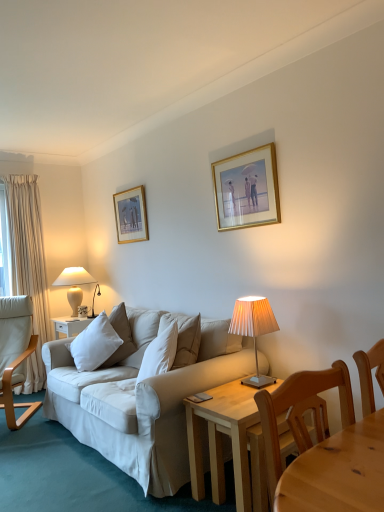
Question: From a real-world perspective, is pleated beige lampshade at center, positioned as the second lamp in left-to-right order, located higher than gold metallic picture frame at upper center, acting as the second picture frame starting from the left?

Choices:
 (A) no
 (B) yes

Answer: (A)

Question: Can you confirm if pleated beige lampshade at center, the 1th lamp positioned from the front, is positioned to the left of gold metallic picture frame at upper center, acting as the first picture frame starting from the front?

Choices:
 (A) yes
 (B) no

Answer: (A)

Question: Can we say pleated beige lampshade at center, which is the first lamp from right to left, lies outside gold metallic picture frame at upper center, the second picture frame from the back?

Choices:
 (A) yes
 (B) no

Answer: (A)

Question: Is pleated beige lampshade at center, arranged as the second lamp when viewed from the back, facing away from gold metallic picture frame at upper center, which is the first picture frame from right to left?

Choices:
 (A) yes
 (B) no

Answer: (B)

Question: Does pleated beige lampshade at center, the 1th lamp positioned from the front, have a lesser height compared to gold metallic picture frame at upper center, which is the first picture frame from right to left?

Choices:
 (A) yes
 (B) no

Answer: (A)

Question: Does pleated beige lampshade at center, the 1th lamp positioned from the front, have a larger size compared to gold metallic picture frame at upper center, acting as the second picture frame starting from the left?

Choices:
 (A) yes
 (B) no

Answer: (A)

Question: Considering the relative positions of light wood table at lower right and light brown wood chair at left, which is the first chair in left-to-right order, in the image provided, is light wood table at lower right in front of light brown wood chair at left, which is the first chair in left-to-right order,?

Choices:
 (A) no
 (B) yes

Answer: (B)

Question: Can you confirm if light wood table at lower right is positioned to the right of light brown wood chair at left, acting as the 1th chair starting from the back?

Choices:
 (A) yes
 (B) no

Answer: (A)

Question: Would you say light wood table at lower right is outside light brown wood chair at left, placed as the 2th chair when sorted from front to back?

Choices:
 (A) no
 (B) yes

Answer: (B)

Question: Is light wood table at lower right looking in the opposite direction of light brown wood chair at left, arranged as the 2th chair when viewed from the right?

Choices:
 (A) yes
 (B) no

Answer: (B)

Question: Is light brown wood chair at left, acting as the 1th chair starting from the back, surrounded by light wood table at lower right?

Choices:
 (A) no
 (B) yes

Answer: (A)

Question: Are light wood table at lower right and light brown wood chair at left, placed as the 2th chair when sorted from front to back, located far from each other?

Choices:
 (A) yes
 (B) no

Answer: (A)

Question: Is light wood table at lower right aimed at gold-framed picture at upper center, which is counted as the 1th picture frame, starting from the back?

Choices:
 (A) no
 (B) yes

Answer: (A)